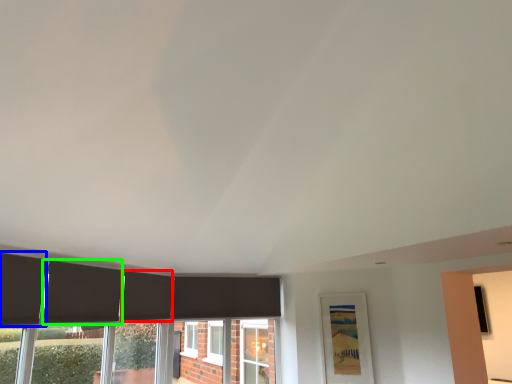
Question: Which object is positioned farthest from curtain (highlighted by a red box)? Select from curtain (highlighted by a blue box) and curtain (highlighted by a green box).

Choices:
 (A) curtain
 (B) curtain

Answer: (A)